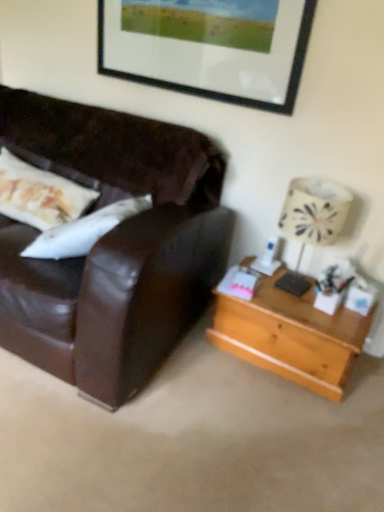
I want to click on vacant space to the left of light brown wooden table at right, so click(199, 368).